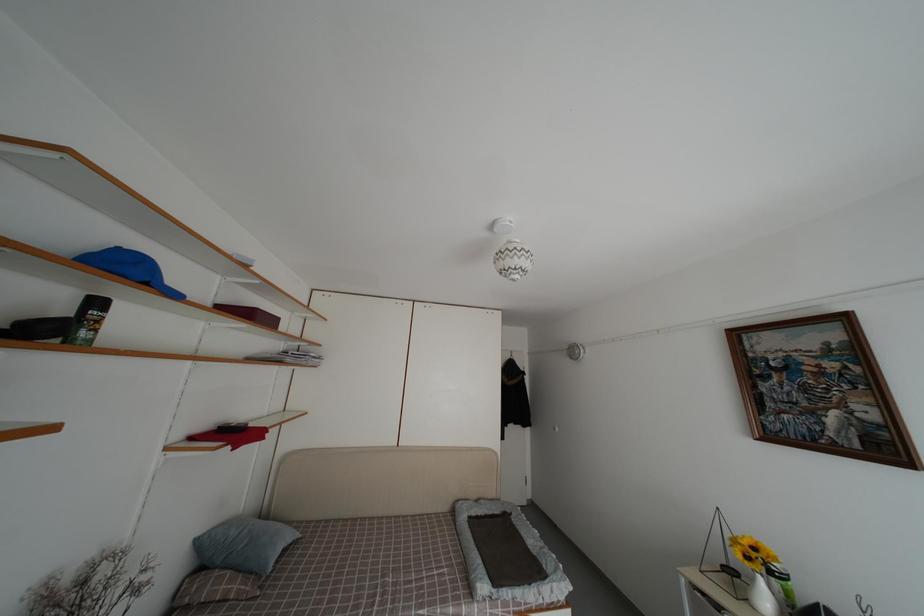
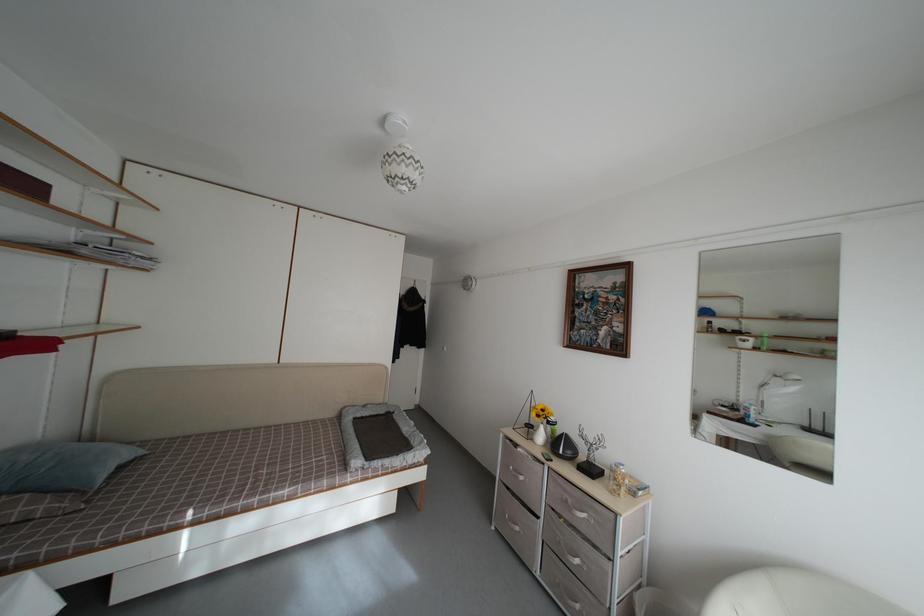
In a continuous first-person perspective shot, in which direction is the camera moving?

The cameraman walked toward right, backward.